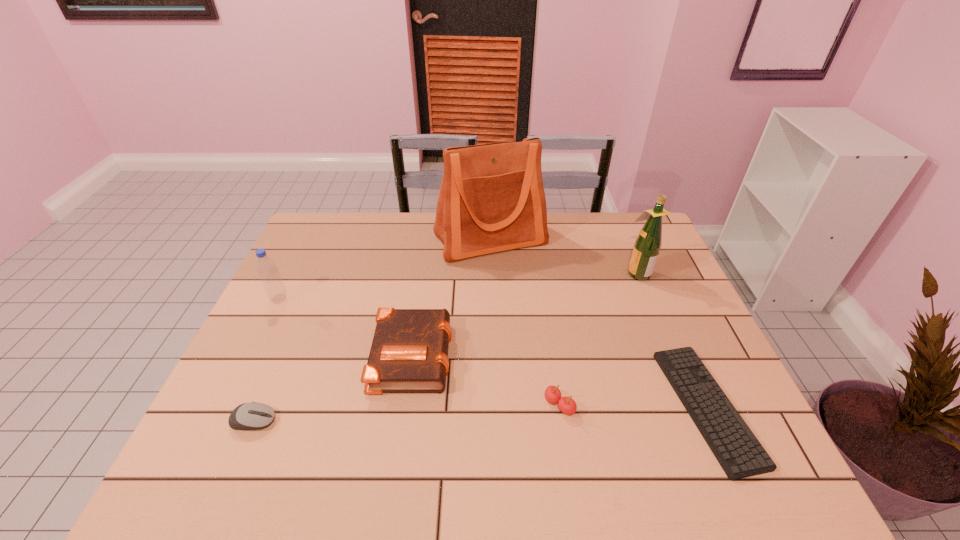
Where is `bottle present at the left edge`? Image resolution: width=960 pixels, height=540 pixels. bottle present at the left edge is located at coordinates (266, 267).

The image size is (960, 540). What are the coordinates of `computer equipment that is at the left edge` in the screenshot? It's located at [x=248, y=416].

Identify the location of liquor that is at the right edge. The width and height of the screenshot is (960, 540). (647, 246).

Identify the location of computer keyboard positioned at the right edge. The width and height of the screenshot is (960, 540). (738, 451).

Find the location of a particular element. object at the near right corner is located at coordinates (738, 451).

Locate an element on the screen. This screenshot has height=540, width=960. vacant space at the far edge of the desktop is located at coordinates (x=588, y=224).

Identify the location of free space at the near edge. (379, 478).

Find the location of a particular element. vacant area at the right edge is located at coordinates (640, 300).

This screenshot has height=540, width=960. Identify the location of vacant space at the near left corner of the desktop. (206, 452).

In the image, there is a desktop. At what (x,y) coordinates should I click in order to perform the action: click on free space at the far right corner. Please return your answer as a coordinate pair (x, y). The height and width of the screenshot is (540, 960). Looking at the image, I should click on (634, 214).